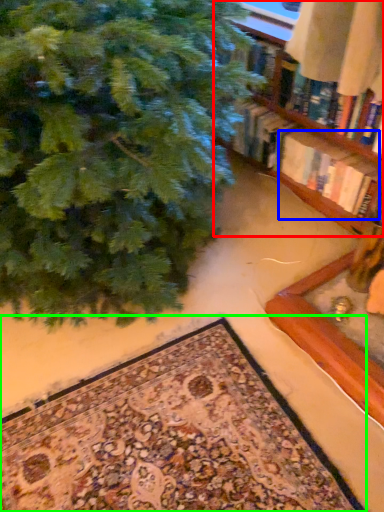
Question: Which object is positioned farthest from shelf (highlighted by a red box)? Select from book (highlighted by a blue box) and mat (highlighted by a green box).

Choices:
 (A) book
 (B) mat

Answer: (B)